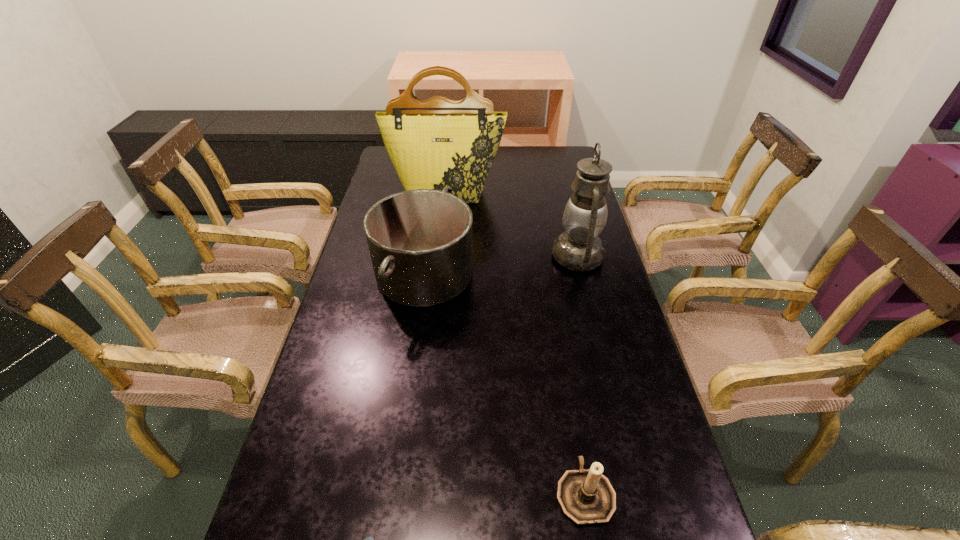
Image resolution: width=960 pixels, height=540 pixels. I want to click on tote bag that is at the left edge, so click(439, 142).

This screenshot has height=540, width=960. What are the coordinates of `pan that is at the left edge` in the screenshot? It's located at (420, 241).

You are a GUI agent. You are given a task and a screenshot of the screen. Output one action in this format:
    pyautogui.click(x=<x>, y=<y>)
    Task: Click on the oil lamp that is at the right edge
    
    Given the screenshot: What is the action you would take?
    pyautogui.click(x=579, y=248)

Identify the location of candle holder positioned at the right edge. Image resolution: width=960 pixels, height=540 pixels. (586, 496).

Find the location of a particular element. The height and width of the screenshot is (540, 960). free space at the far edge of the desktop is located at coordinates (517, 156).

Identify the location of vacant space at the left edge of the desktop. (320, 507).

You are a GUI agent. You are given a task and a screenshot of the screen. Output one action in this format:
    pyautogui.click(x=<x>, y=<y>)
    Task: Click on the blank space at the right edge
    The width and height of the screenshot is (960, 540).
    Given the screenshot: What is the action you would take?
    pyautogui.click(x=577, y=357)

Locate an element on the screen. The height and width of the screenshot is (540, 960). vacant space at the far right corner of the desktop is located at coordinates (560, 161).

Find the location of `vacant space that is in between the third tallest object and the oil lamp`. vacant space that is in between the third tallest object and the oil lamp is located at coordinates (501, 265).

What are the coordinates of `blank region between the oil lamp and the farthest object` in the screenshot? It's located at (513, 224).